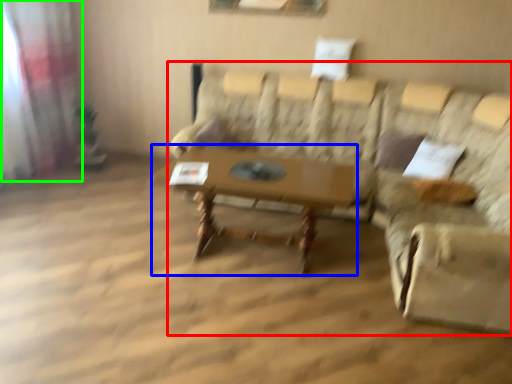
Question: Based on their relative distances, which object is nearer to studio couch (highlighted by a red box)? Choose from table (highlighted by a blue box) and curtain (highlighted by a green box).

Choices:
 (A) table
 (B) curtain

Answer: (A)